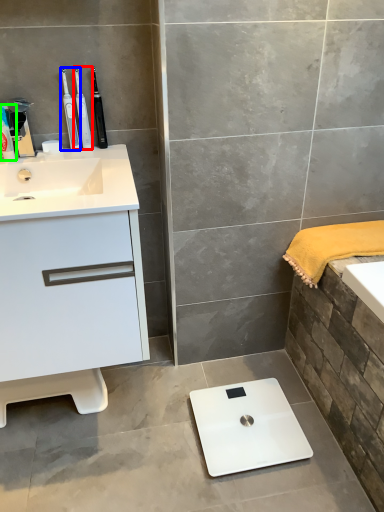
Question: Which object is positioned farthest from toothbrush (highlighted by a red box)? Select from toothbrush (highlighted by a blue box) and toiletry (highlighted by a green box).

Choices:
 (A) toothbrush
 (B) toiletry

Answer: (B)